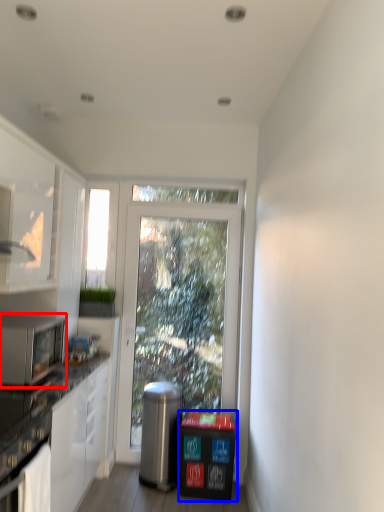
Question: Which point is further to the camera, microwave oven (highlighted by a red box) or recycling bin (highlighted by a blue box)?

Choices:
 (A) microwave oven
 (B) recycling bin

Answer: (B)